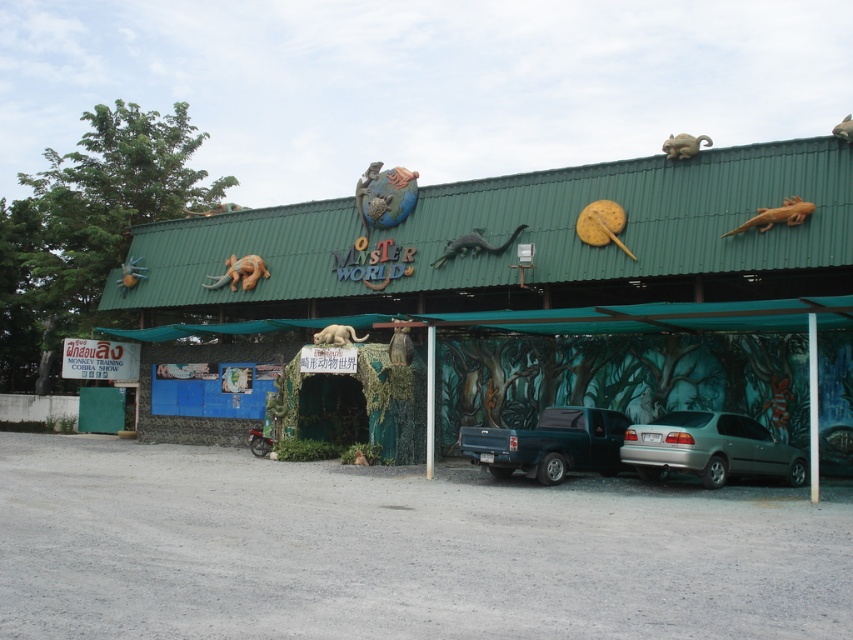
Question: Is green matte lizard at center below white fur cat at center?

Choices:
 (A) yes
 (B) no

Answer: (B)

Question: Which point is closer to the camera taking this photo?

Choices:
 (A) (245, 275)
 (B) (845, 132)
 (C) (685, 316)

Answer: (C)

Question: Estimate the real-world distances between objects in this image. Which object is closer to the brown furry animal at center?

Choices:
 (A) orange fuzzy spider at upper left
 (B) white fur cat at center

Answer: (B)

Question: Does green textured hut at center appear on the right side of yellow matte pin at upper center?

Choices:
 (A) no
 (B) yes

Answer: (A)

Question: Is brown matte lizard at upper center bigger than brown furry animal at center?

Choices:
 (A) yes
 (B) no

Answer: (A)

Question: Which point is farther to the camera?

Choices:
 (A) orange fuzzy spider at upper left
 (B) brown matte lizard at upper center
 (C) metallic blue truck at center
 (D) brown textured lizard at center

Answer: (A)